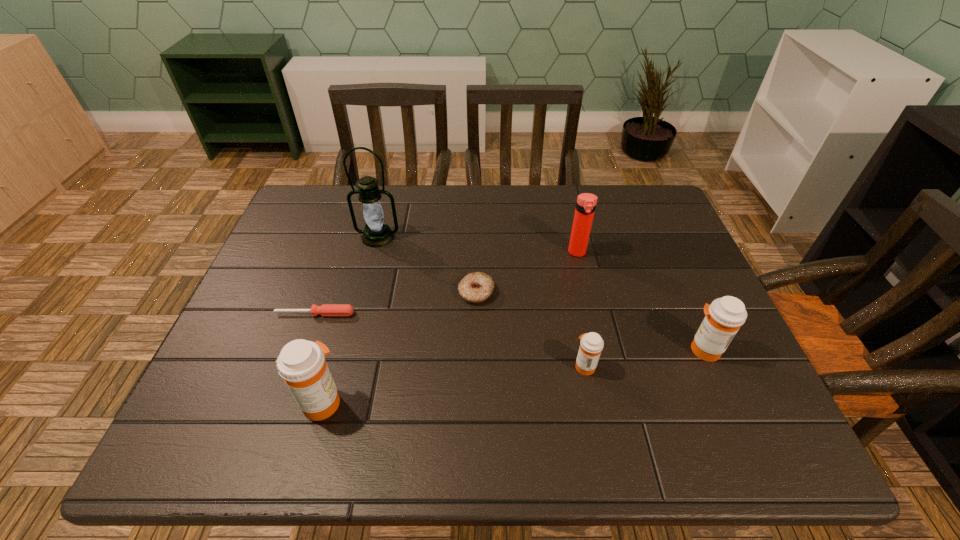
Please point a spot to place another medicine for symmetrical spacing. Please provide its 2D coordinates. Your answer should be formatted as a tuple, i.e. [(x, y)], where the tuple contains the x and y coordinates of a point satisfying the conditions above.

[(458, 383)]